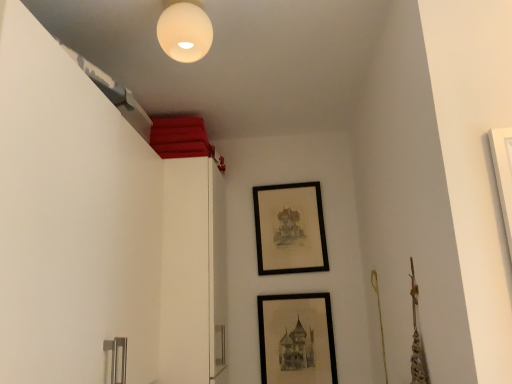
Question: Is the position of black matte picture frame at lower center, which appears as the 2th picture frame when viewed from the back, less distant than that of white matte sphere at upper center?

Choices:
 (A) no
 (B) yes

Answer: (A)

Question: Is black matte picture frame at lower center, which appears as the 2th picture frame when viewed from the back, surrounding white matte sphere at upper center?

Choices:
 (A) no
 (B) yes

Answer: (A)

Question: Is black matte picture frame at lower center, which appears as the second picture frame when viewed from the top, at the left side of white matte sphere at upper center?

Choices:
 (A) no
 (B) yes

Answer: (A)

Question: From the image's perspective, does black matte picture frame at lower center, which is the first picture frame in bottom-to-top order, appear lower than white matte sphere at upper center?

Choices:
 (A) no
 (B) yes

Answer: (B)

Question: Considering the relative sizes of black matte picture frame at lower center, the first picture frame positioned from the front, and white matte sphere at upper center in the image provided, is black matte picture frame at lower center, the first picture frame positioned from the front, bigger than white matte sphere at upper center?

Choices:
 (A) yes
 (B) no

Answer: (A)

Question: Relative to black matte picture frame at upper center, which appears as the second picture frame when viewed from the front, is white matte sphere at upper center in front or behind?

Choices:
 (A) front
 (B) behind

Answer: (A)

Question: Does point (181, 34) appear closer or farther from the camera than point (294, 258)?

Choices:
 (A) closer
 (B) farther

Answer: (A)

Question: From the image's perspective, is white matte sphere at upper center above or below black matte picture frame at upper center, which appears as the second picture frame when viewed from the front?

Choices:
 (A) above
 (B) below

Answer: (A)

Question: Is white matte sphere at upper center to the left or to the right of black matte picture frame at upper center, which is the first picture frame in back-to-front order, in the image?

Choices:
 (A) left
 (B) right

Answer: (A)

Question: Considering the relative positions of black matte picture frame at lower center, which is the first picture frame in bottom-to-top order, and white matte sphere at upper center in the image provided, is black matte picture frame at lower center, which is the first picture frame in bottom-to-top order, to the left or to the right of white matte sphere at upper center?

Choices:
 (A) left
 (B) right

Answer: (B)

Question: Considering the positions of black matte picture frame at lower center, which is the first picture frame in bottom-to-top order, and white matte sphere at upper center in the image, is black matte picture frame at lower center, which is the first picture frame in bottom-to-top order, taller or shorter than white matte sphere at upper center?

Choices:
 (A) short
 (B) tall

Answer: (B)

Question: Considering the positions of point (273, 309) and point (198, 29), is point (273, 309) closer or farther from the camera than point (198, 29)?

Choices:
 (A) farther
 (B) closer

Answer: (A)

Question: Is black matte picture frame at lower center, which is the first picture frame in bottom-to-top order, in front of or behind white matte sphere at upper center in the image?

Choices:
 (A) front
 (B) behind

Answer: (B)

Question: From a real-world perspective, is black matte picture frame at upper center, which is the first picture frame in back-to-front order, above or below white matte sphere at upper center?

Choices:
 (A) above
 (B) below

Answer: (B)

Question: From their relative heights in the image, would you say black matte picture frame at upper center, which appears as the second picture frame when viewed from the front, is taller or shorter than white matte sphere at upper center?

Choices:
 (A) tall
 (B) short

Answer: (A)